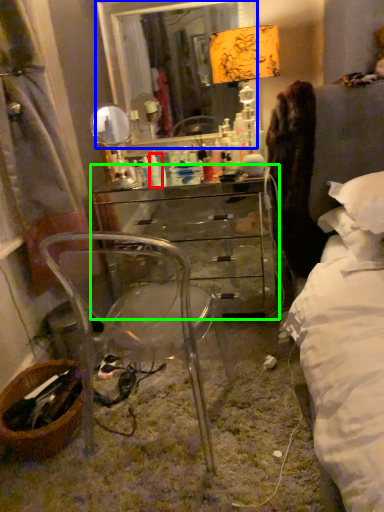
Question: Considering the real-world distances, which object is farthest from toiletry (highlighted by a red box)? mirror (highlighted by a blue box) or chest of drawers (highlighted by a green box)?

Choices:
 (A) mirror
 (B) chest of drawers

Answer: (A)